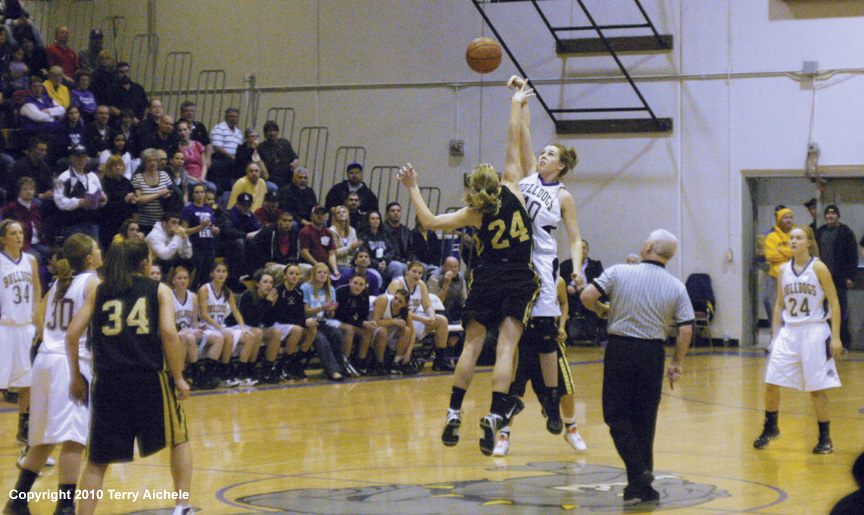
At what (x,y) coordinates should I click in order to perform the action: click on door. Please return your answer as a coordinate pair (x, y). The height and width of the screenshot is (515, 864). Looking at the image, I should click on (778, 188), (846, 193).